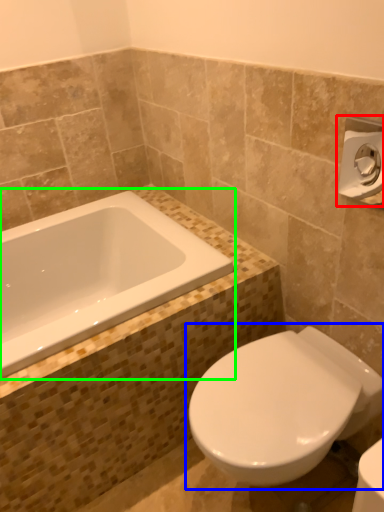
Question: Which object is positioned closest to towel bar (highlighted by a red box)? Select from toilet (highlighted by a blue box) and bathtub (highlighted by a green box).

Choices:
 (A) toilet
 (B) bathtub

Answer: (A)